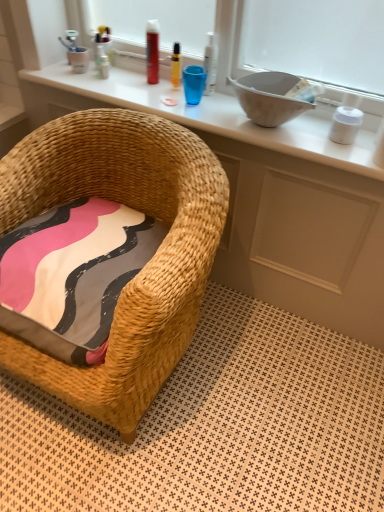
You are a GUI agent. You are given a task and a screenshot of the screen. Output one action in this format:
    pyautogui.click(x=<x>, y=<y>)
    Task: Click on the space that is in front of white plastic bottle at upper center, which ranks as the 1th toiletry in left-to-right order
    The image size is (384, 512).
    Given the screenshot: What is the action you would take?
    pyautogui.click(x=111, y=90)